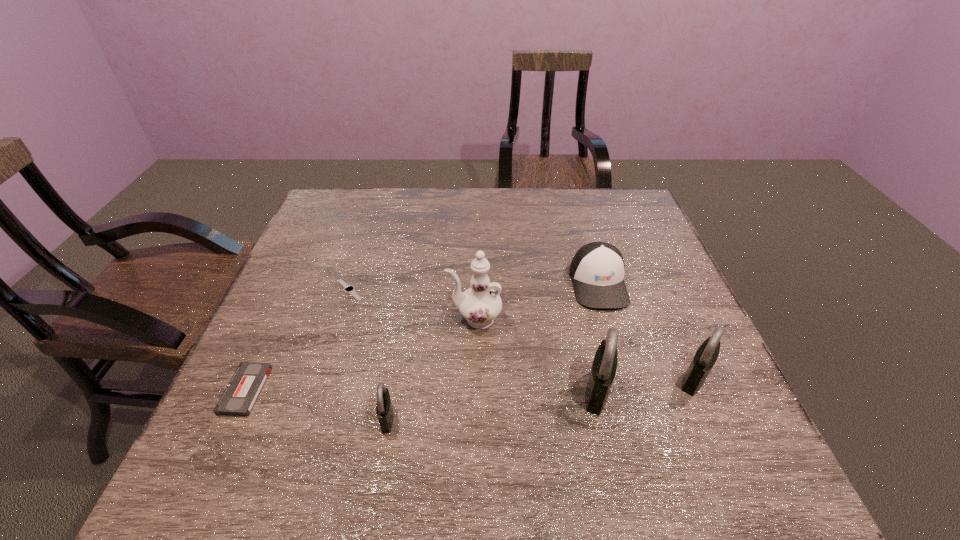
Please point a spot to place another padlock for symmetrical spacing. Please provide its 2D coordinates. Your answer should be formatted as a tuple, i.e. [(x, y)], where the tuple contains the x and y coordinates of a point satisfying the conditions above.

[(494, 404)]